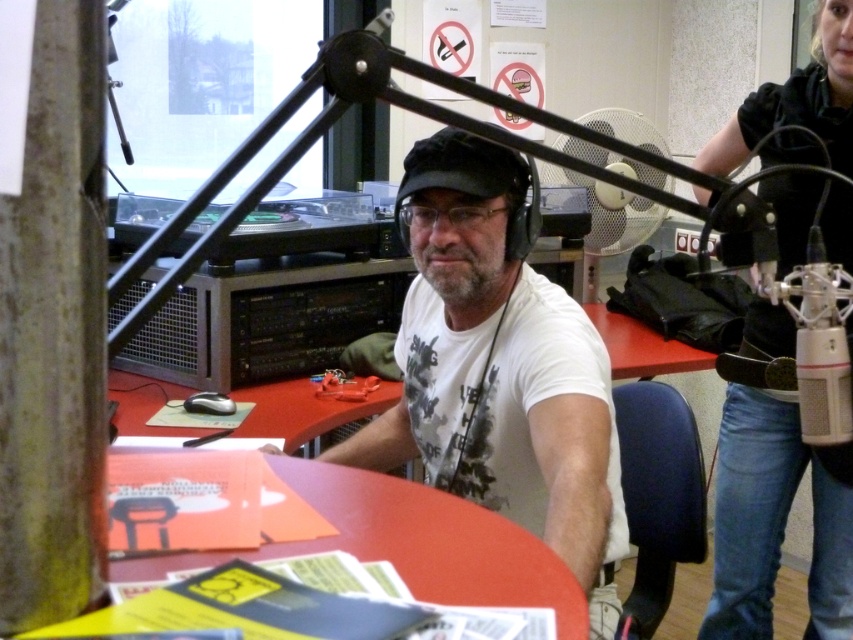
Does white matte t-shirt at center have a greater height compared to black leather jacket at upper right?

No, white matte t-shirt at center is not taller than black leather jacket at upper right.

Does point (561, 550) lie behind point (735, 595)?

No, it is in front of (735, 595).

I want to click on white matte t-shirt at center, so click(498, 371).